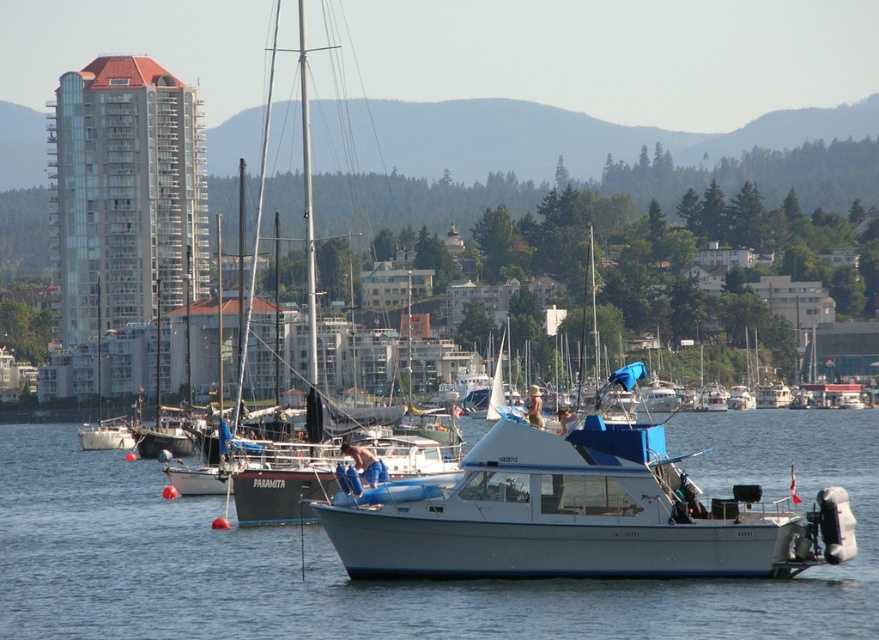
Question: Which object is farther from the camera taking this photo?

Choices:
 (A) white glossy water at center
 (B) white matte sailboat at center

Answer: (B)

Question: Estimate the real-world distances between objects in this image. Which object is farther from the white glossy water at center?

Choices:
 (A) white glossy boat at center
 (B) white matte sailboat at center

Answer: (A)

Question: Which object is the farthest from the white glossy water at center?

Choices:
 (A) white glossy boat at center
 (B) white matte sailboat at center

Answer: (A)

Question: Can you confirm if white glossy boat at center is positioned below white matte sailboat at center?

Choices:
 (A) no
 (B) yes

Answer: (B)

Question: Can you confirm if white glossy water at center is wider than white glossy boat at center?

Choices:
 (A) no
 (B) yes

Answer: (B)

Question: Does white glossy water at center lie behind white matte sailboat at center?

Choices:
 (A) yes
 (B) no

Answer: (B)